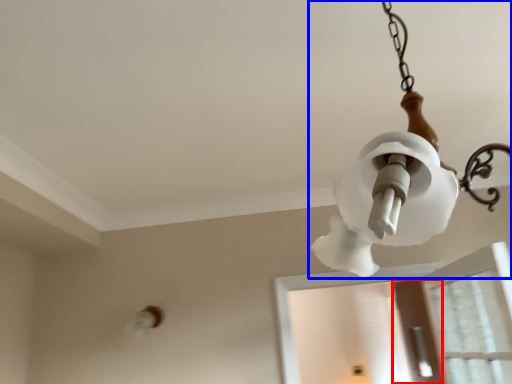
Question: Among these objects, which one is farthest to the camera, screen door (highlighted by a red box) or lamp (highlighted by a blue box)?

Choices:
 (A) screen door
 (B) lamp

Answer: (A)